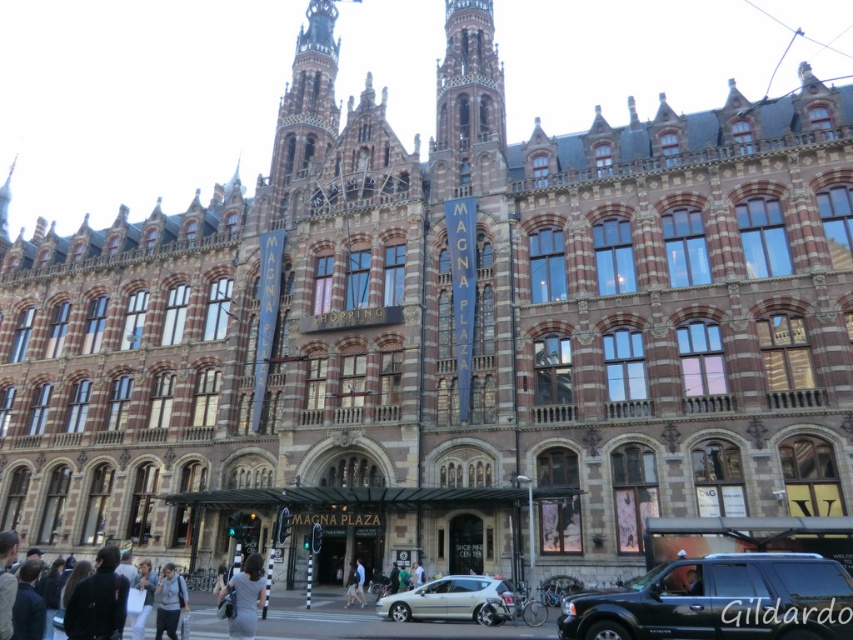
Who is taller, dark gray dress at lower center or light gray fabric jacket at lower center?

Standing taller between the two is dark gray dress at lower center.

Does point (218, 595) come behind point (165, 572)?

That is True.

Find the location of a particular element. The image size is (853, 640). dark gray dress at lower center is located at coordinates (245, 596).

Can you confirm if shiny black suv at lower right is bigger than dark gray dress at lower center?

No, shiny black suv at lower right is not bigger than dark gray dress at lower center.

Is point (759, 570) closer to camera compared to point (247, 596)?

That is True.

Identify the location of shiny black suv at lower right. (718, 600).

Does shiny black suv at lower right appear over silver metallic car at center?

Yes, shiny black suv at lower right is above silver metallic car at center.

Does point (585, 602) lie behind point (422, 611)?

That is False.

Image resolution: width=853 pixels, height=640 pixels. What are the coordinates of `shiny black suv at lower right` in the screenshot? It's located at (718, 600).